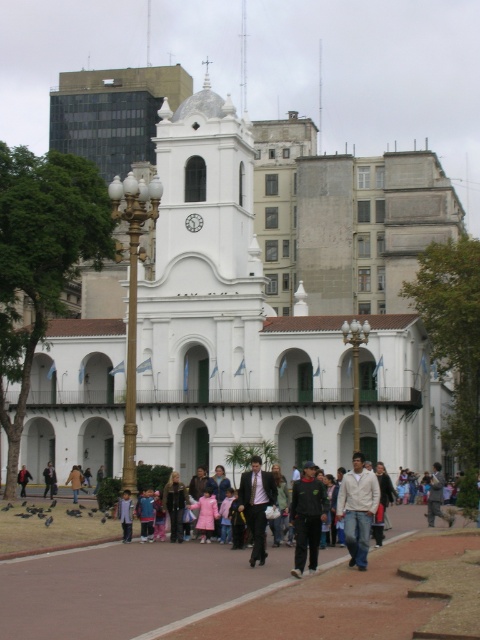
You are standing at the point closest to the historic building. Which of the two points, point (x=178, y=156) or point (x=128, y=490), is farther away from you?

Point (x=178, y=156) is farther away from you because it is behind point (x=128, y=490).

You are standing in the plaza in front of the historic building. You want to take a photo of the white smooth church at center while keeping the light blue denim jacket at center in the foreground. Can you do this without moving either object?

The white smooth church at center is 50.71 meters from the light blue denim jacket at center. Since the distance between them is significant, you can position yourself so that the light blue denim jacket at center is in the foreground while the white smooth church at center fills the background, capturing both in a single frame without needing to move either object.